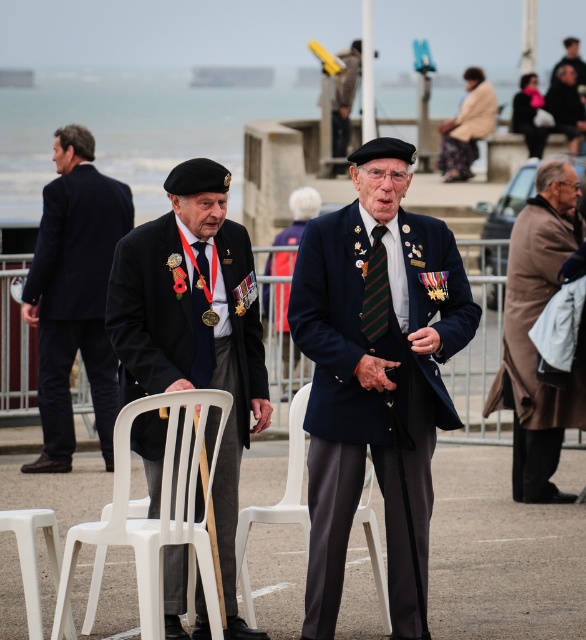
Is point (515, 316) positioned behind point (374, 317)?

Yes, point (515, 316) is behind point (374, 317).

Between brown wool coat at right and green striped tie at center, which one appears on the left side from the viewer's perspective?

green striped tie at center is more to the left.

Is point (578, 422) positioned after point (362, 305)?

Yes.

The image size is (586, 640). Identify the location of brown wool coat at right. (529, 339).

Based on the photo, can you confirm if gold metallic tie at center is taller than dark blue uniform at upper right?

No, gold metallic tie at center is not taller than dark blue uniform at upper right.

Describe the element at coordinates (202, 323) in the screenshot. I see `gold metallic tie at center` at that location.

Where is `gold metallic tie at center`? Image resolution: width=586 pixels, height=640 pixels. gold metallic tie at center is located at coordinates (202, 323).

Between point (359, 410) and point (575, 70), which one is positioned in front?

Point (359, 410) is in front.

Can you confirm if navy blue fabric jacket at center is positioned to the right of dark blue uniform at upper right?

In fact, navy blue fabric jacket at center is to the left of dark blue uniform at upper right.

Is point (340, 273) in front of point (580, 74)?

Yes, point (340, 273) is closer to viewer.

At what (x,y) coordinates should I click in order to perform the action: click on navy blue fabric jacket at center. Please return your answer as a coordinate pair (x, y). Looking at the image, I should click on (372, 400).